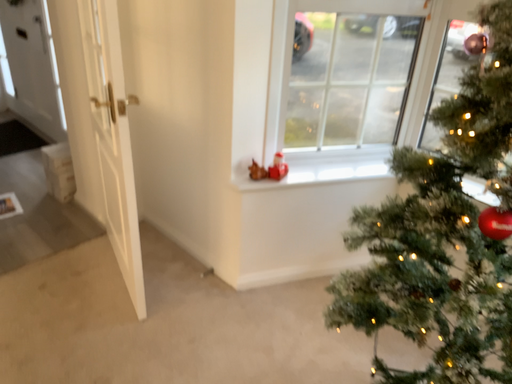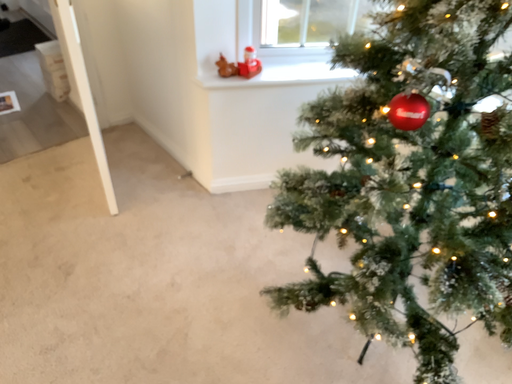
Question: How did the camera likely rotate when shooting the video?

Choices:
 (A) rotated upward
 (B) rotated downward

Answer: (B)